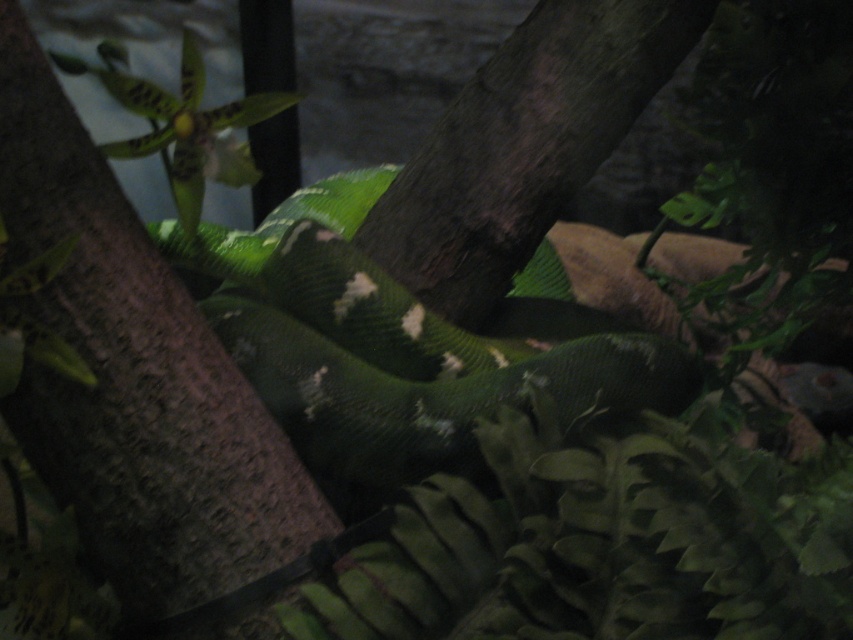
Question: Does smooth brown tree trunk at center have a lesser width compared to green matte snake at center?

Choices:
 (A) yes
 (B) no

Answer: (A)

Question: Which of the following is the farthest from the observer?

Choices:
 (A) smooth brown tree trunk at center
 (B) green matte snake at center

Answer: (B)

Question: Which point is farther from the camera taking this photo?

Choices:
 (A) (364, 376)
 (B) (50, 436)

Answer: (A)

Question: Can you confirm if smooth brown tree trunk at center is thinner than green matte snake at center?

Choices:
 (A) no
 (B) yes

Answer: (B)

Question: Which of the following is the closest to the observer?

Choices:
 (A) smooth brown tree trunk at center
 (B) green matte snake at center

Answer: (A)

Question: Can you confirm if smooth brown tree trunk at center is wider than green matte snake at center?

Choices:
 (A) yes
 (B) no

Answer: (B)